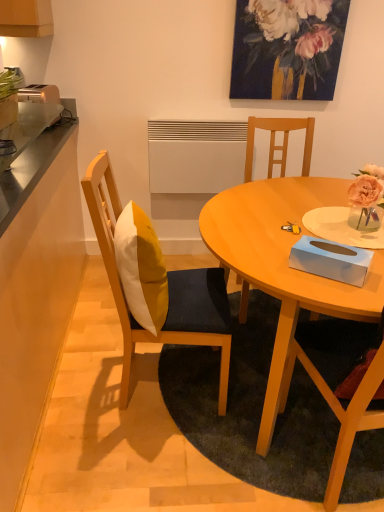
This screenshot has height=512, width=384. I want to click on blank space to the left of dark gray carpet at lower center, so click(109, 387).